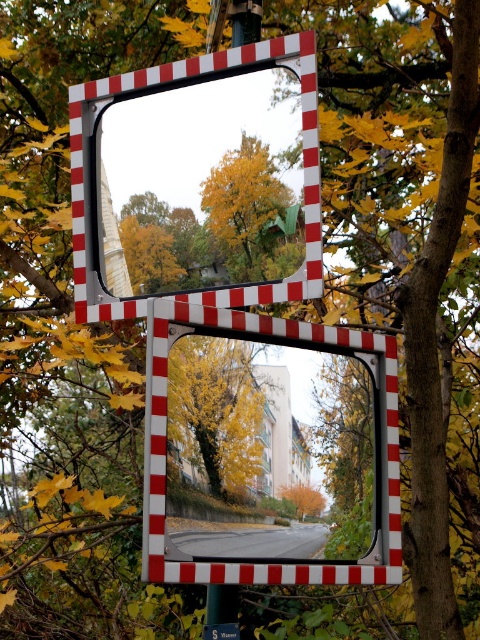
Question: Is reflective glass mirror at center below green plastic sign at lower center?

Choices:
 (A) yes
 (B) no

Answer: (B)

Question: Can you confirm if reflective glass mirror at center is positioned above green plastic sign at lower center?

Choices:
 (A) yes
 (B) no

Answer: (A)

Question: Does reflective glass mirror at center appear over green plastic sign at lower center?

Choices:
 (A) yes
 (B) no

Answer: (A)

Question: Which point appears farthest from the camera in this image?

Choices:
 (A) (216, 627)
 (B) (339, 572)

Answer: (B)